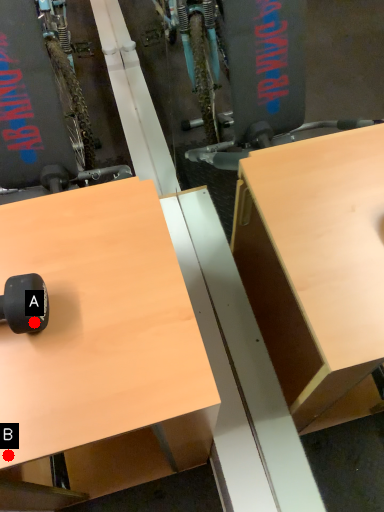
Question: Two points are circled on the image, labeled by A and B beside each circle. Which point is farther from the camera taking this photo?

Choices:
 (A) A is further
 (B) B is further

Answer: (A)